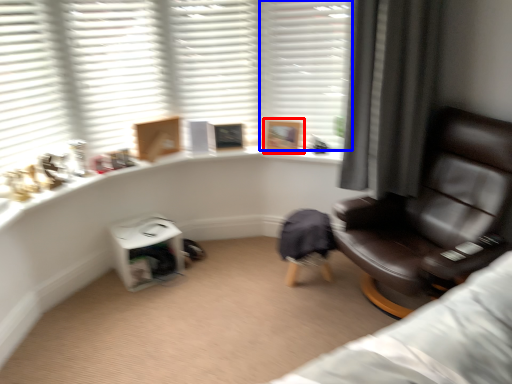
Question: Among these objects, which one is farthest to the camera, picture frame (highlighted by a red box) or shutter (highlighted by a blue box)?

Choices:
 (A) picture frame
 (B) shutter

Answer: (A)